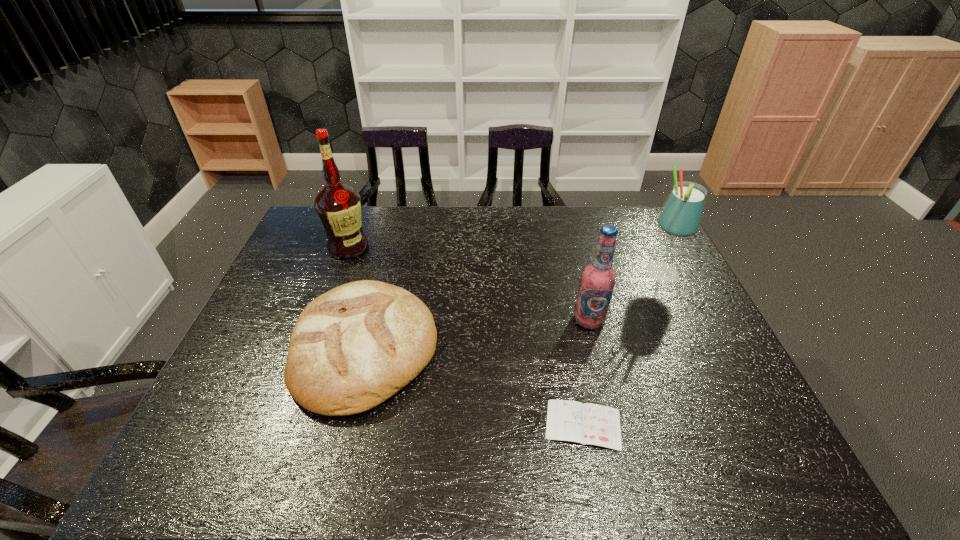
Identify which object is the fourth nearest to the rightmost object. Please provide its 2D coordinates. Your answer should be formatted as a tuple, i.e. [(x, y)], where the tuple contains the x and y coordinates of a point satisfying the conditions above.

[(338, 206)]

The height and width of the screenshot is (540, 960). In order to click on object identified as the fourth closest to the leftmost alcohol in this screenshot , I will do `click(681, 216)`.

Locate which alcohol is the third closest to the bread. Please provide its 2D coordinates. Your answer should be formatted as a tuple, i.e. [(x, y)], where the tuple contains the x and y coordinates of a point satisfying the conditions above.

[(681, 216)]

The image size is (960, 540). In order to click on alcohol that stands as the closest to the rightmost alcohol in this screenshot , I will do `click(598, 278)`.

Where is `free space that satisfies the following two spatial constraints: 1. on the label of the leftmost alcohol; 2. on the left side of the shortest object`? This screenshot has width=960, height=540. free space that satisfies the following two spatial constraints: 1. on the label of the leftmost alcohol; 2. on the left side of the shortest object is located at coordinates (283, 424).

Locate an element on the screen. vacant space that satisfies the following two spatial constraints: 1. on the back side of the diary; 2. on the right side of the third tallest object is located at coordinates (564, 320).

The width and height of the screenshot is (960, 540). Identify the location of vacant space that satisfies the following two spatial constraints: 1. on the back side of the diary; 2. on the right side of the rightmost alcohol. (554, 274).

This screenshot has width=960, height=540. What are the coordinates of `vacant space that satisfies the following two spatial constraints: 1. on the back side of the shortest alcohol; 2. on the right side of the rightmost object` in the screenshot? It's located at (577, 274).

I want to click on vacant space that satisfies the following two spatial constraints: 1. on the label of the nearest alcohol; 2. on the left side of the leftmost alcohol, so click(322, 320).

At what (x,y) coordinates should I click in order to perform the action: click on free location that satisfies the following two spatial constraints: 1. on the label of the bread; 2. on the left side of the leftmost alcohol. Please return your answer as a coordinate pair (x, y). The image size is (960, 540). Looking at the image, I should click on (311, 349).